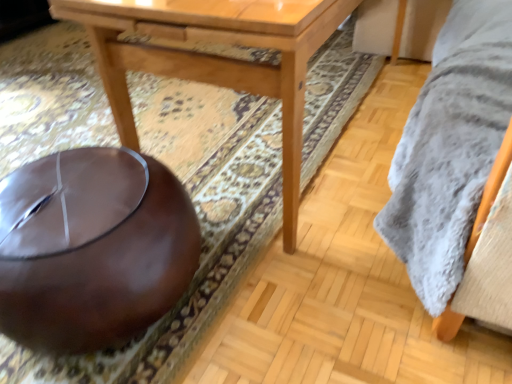
Question: Is light brown wood table at center positioned behind brown leather bean bag at lower left?

Choices:
 (A) yes
 (B) no

Answer: (A)

Question: Would you say brown leather bean bag at lower left is part of light brown wood table at center's contents?

Choices:
 (A) yes
 (B) no

Answer: (B)

Question: Considering the relative sizes of light brown wood table at center and brown leather bean bag at lower left in the image provided, is light brown wood table at center shorter than brown leather bean bag at lower left?

Choices:
 (A) yes
 (B) no

Answer: (B)

Question: Is light brown wood table at center taller than brown leather bean bag at lower left?

Choices:
 (A) yes
 (B) no

Answer: (A)

Question: Could you tell me if light brown wood table at center is facing brown leather bean bag at lower left?

Choices:
 (A) yes
 (B) no

Answer: (B)

Question: Does light brown wood table at center have a greater width compared to brown leather bean bag at lower left?

Choices:
 (A) yes
 (B) no

Answer: (A)

Question: Does brown leather bean bag at lower left have a lesser height compared to light brown wood table at center?

Choices:
 (A) yes
 (B) no

Answer: (A)

Question: From the image's perspective, does brown leather bean bag at lower left appear higher than light brown wood table at center?

Choices:
 (A) no
 (B) yes

Answer: (A)

Question: Is brown leather bean bag at lower left completely or partially outside of light brown wood table at center?

Choices:
 (A) yes
 (B) no

Answer: (A)

Question: Is the position of brown leather bean bag at lower left less distant than that of light brown wood table at center?

Choices:
 (A) yes
 (B) no

Answer: (A)

Question: Can you confirm if brown leather bean bag at lower left is bigger than light brown wood table at center?

Choices:
 (A) no
 (B) yes

Answer: (A)

Question: Considering the relative sizes of brown leather bean bag at lower left and light brown wood table at center in the image provided, is brown leather bean bag at lower left taller than light brown wood table at center?

Choices:
 (A) no
 (B) yes

Answer: (A)

Question: Looking at the image, does light brown wood table at center seem bigger or smaller compared to brown leather bean bag at lower left?

Choices:
 (A) small
 (B) big

Answer: (B)